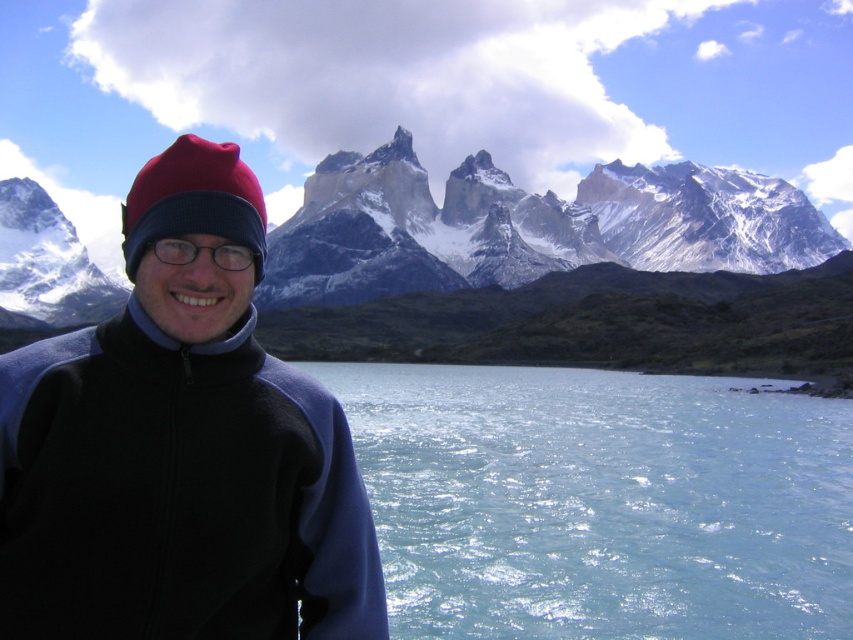
You are a photographer planning to capture the reflection of the snowy granite mountain range at upper center in the clear water at lower center. Based on the scene, can you determine if the reflection will be visible in the water?

The distance between the clear water at lower center and the snowy granite mountain range at upper center is 92.58 meters. Since reflections require a clear line of sight and calm water, and the water is described as clear and calm with gentle ripples, the reflection of the snowy granite mountain range at upper center should be visible in the clear water at lower center.

You are a photographer planning to capture the entire scene in one shot. Given that the clear water at lower center and the snowy granite mountain range at upper center are both in view, which of these two elements occupies a smaller portion of the image horizontally?

The clear water at lower center occupies a smaller horizontal portion of the image because its width is less than that of the snowy granite mountain range at upper center.

You are a photographer trying to capture the snowy granite mountain range at upper center and the clear water at lower center in a single shot. Based on their positions, which object should you adjust your camera to focus on first to ensure both are in frame?

The clear water at lower center is positioned on the left side of snowy granite mountain range at upper center. To ensure both are in frame, focus on the snowy granite mountain range at upper center first as it is centrally located and the clear water at lower center will naturally be included on its left side.